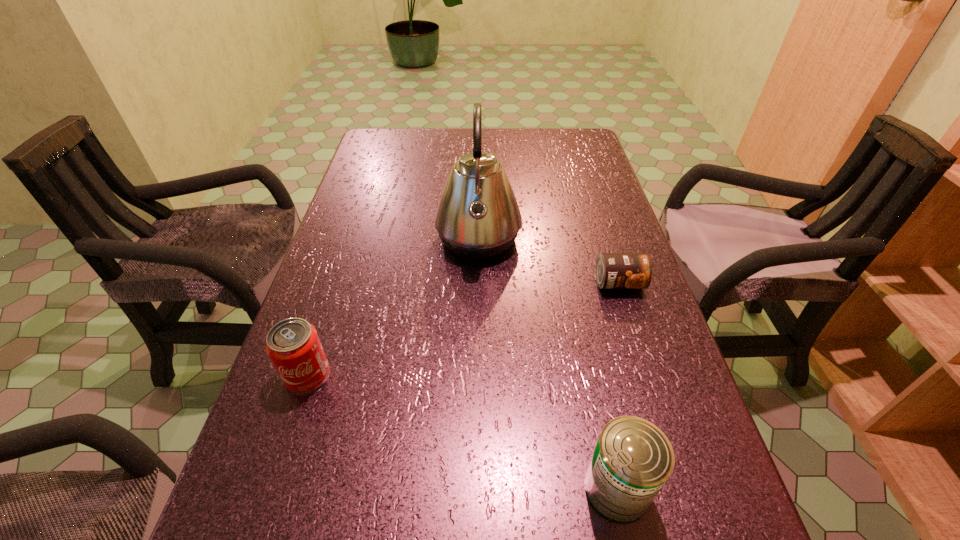
This screenshot has height=540, width=960. Find the location of `free location located on the back of the second farthest can`. free location located on the back of the second farthest can is located at coordinates (349, 249).

Image resolution: width=960 pixels, height=540 pixels. Find the location of `blank space located on the front label of the farthest can`. blank space located on the front label of the farthest can is located at coordinates (644, 363).

Find the location of a particular element. object that is at the left edge is located at coordinates (293, 345).

You are a GUI agent. You are given a task and a screenshot of the screen. Output one action in this format:
    pyautogui.click(x=<x>, y=<y>)
    Task: Click on the free space at the far edge of the desktop
    The width and height of the screenshot is (960, 540).
    Given the screenshot: What is the action you would take?
    pyautogui.click(x=447, y=156)

I want to click on free space at the left edge of the desktop, so click(x=294, y=539).

This screenshot has height=540, width=960. In the image, there is a desktop. Identify the location of vacant space at the right edge. (687, 449).

Image resolution: width=960 pixels, height=540 pixels. Find the location of `blank space at the far left corner of the desktop`. blank space at the far left corner of the desktop is located at coordinates (403, 160).

Find the location of `free space between the second nearest can and the rightmost can`. free space between the second nearest can and the rightmost can is located at coordinates (463, 329).

Locate an element on the screen. The image size is (960, 540). free point between the kettle and the rightmost can is located at coordinates (548, 261).

Where is `free point between the leftmost object and the nearest can`? The height and width of the screenshot is (540, 960). free point between the leftmost object and the nearest can is located at coordinates (462, 432).